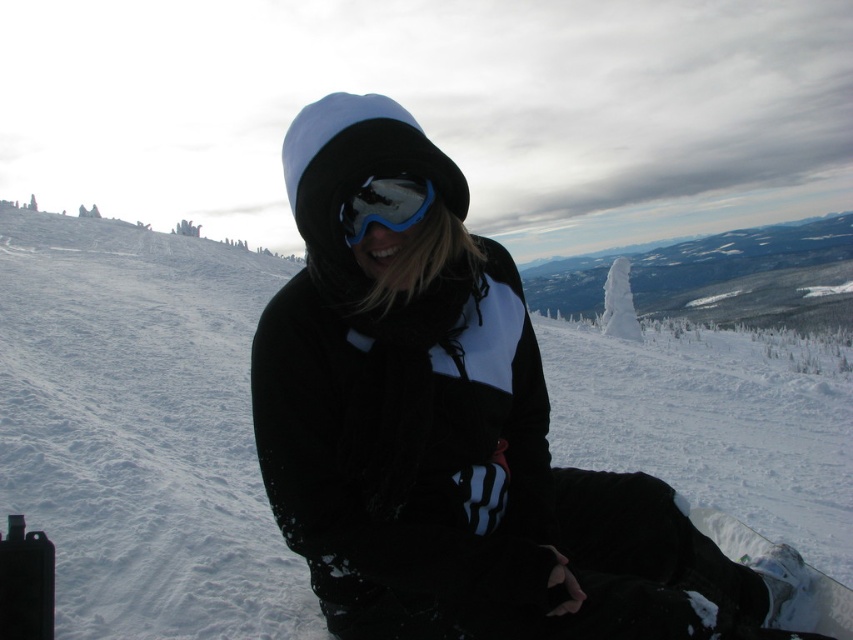
You are standing at the point labeled point (412, 179) and want to move towards the point labeled point (828, 589). Given the snowy slope and the person sitting there, will the person be visible to you as you move along this path?

The point 0.922, 0.972 is behind point (412, 179), so the person sitting there would not be visible from your current position at point (412, 179) as you move along the path.

You are planning to place a 10 meter long banner between the white fluffy snow at center and the matte blue ski goggles at center. Will the banner be long enough to stretch between them?

The distance between the white fluffy snow at center and the matte blue ski goggles at center is 9.69 meters. Since the banner is 10 meters long, it will be long enough to stretch between them with a little extra length remaining.

You are a photographer trying to capture the scene with the white fluffy snow at center and the white glossy snowboard at lower right. To ensure both are in the frame, should you adjust your camera angle to the left or the right?

The white fluffy snow at center is positioned on the left side of white glossy snowboard at lower right, so you should adjust your camera angle to the left to include both objects in the frame.